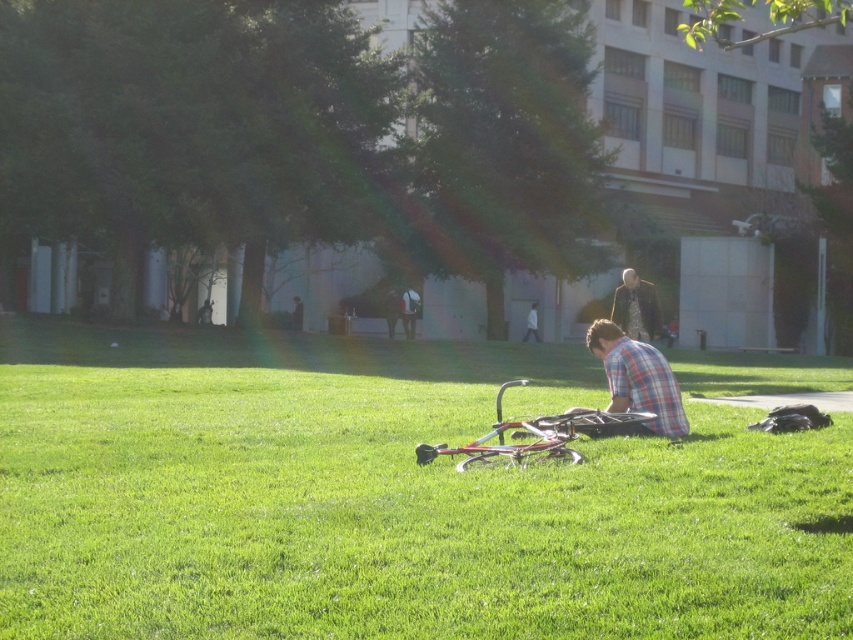
Can you confirm if metallic silver bicycle at center is positioned above plaid fabric shirt at center?

No.

Does point (508, 448) come in front of point (631, 374)?

Yes, it is in front of point (631, 374).

Locate an element on the screen. Image resolution: width=853 pixels, height=640 pixels. metallic silver bicycle at center is located at coordinates (537, 435).

Does metallic bicycle at center come in front of plaid fabric shirt at center?

Yes, metallic bicycle at center is closer to the viewer.

Which is in front, point (381, 355) or point (630, 356)?

Positioned in front is point (630, 356).

In order to click on metallic bicycle at center in this screenshot , I will do `click(387, 499)`.

Where is `metallic bicycle at center`? The image size is (853, 640). metallic bicycle at center is located at coordinates 387,499.

You are a GUI agent. You are given a task and a screenshot of the screen. Output one action in this format:
    pyautogui.click(x=<x>, y=<y>)
    Task: Click on the plaid fabric shirt at center
    
    Given the screenshot: What is the action you would take?
    pyautogui.click(x=637, y=378)

Does point (642, 401) lie in front of point (656, 305)?

Yes, it is.

You are a GUI agent. You are given a task and a screenshot of the screen. Output one action in this format:
    pyautogui.click(x=<x>, y=<y>)
    Task: Click on the plaid fabric shirt at center
    
    Given the screenshot: What is the action you would take?
    pyautogui.click(x=637, y=378)

The width and height of the screenshot is (853, 640). In order to click on plaid fabric shirt at center in this screenshot , I will do `click(637, 378)`.